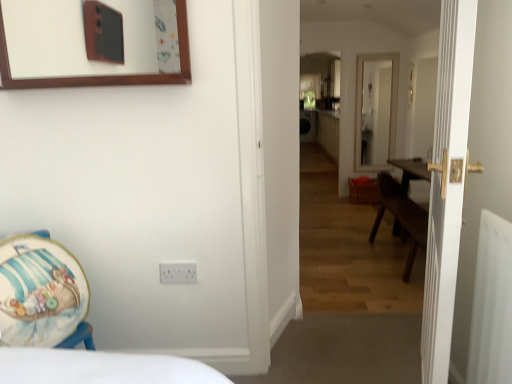
What do you see at coordinates (492, 304) in the screenshot?
I see `white plastic radiator at right` at bounding box center [492, 304].

This screenshot has width=512, height=384. In order to click on wooden floor at center in this screenshot , I will do `click(353, 163)`.

Would you consider white wooden door at right to be distant from brown wooden picture frame at upper left?

That's right, there is a large distance between white wooden door at right and brown wooden picture frame at upper left.

Which object is positioned more to the left, white wooden door at right or brown wooden picture frame at upper left?

brown wooden picture frame at upper left.

From a real-world perspective, between white wooden door at right and brown wooden picture frame at upper left, who is vertically lower?

white wooden door at right.

Locate an element on the screen. picture frame above the white wooden door at right (from the image's perspective) is located at coordinates (106, 75).

Consider the image. Considering the sizes of objects white plastic electric outlet at lower center and white wooden door at right in the image provided, who is smaller, white plastic electric outlet at lower center or white wooden door at right?

With smaller size is white plastic electric outlet at lower center.

Would you say white plastic electric outlet at lower center is outside white wooden door at right?

Indeed, white plastic electric outlet at lower center is completely outside white wooden door at right.

Does white plastic electric outlet at lower center touch white wooden door at right?

No, white plastic electric outlet at lower center is not making contact with white wooden door at right.

Does point (161, 266) appear closer or farther from the camera than point (452, 295)?

Point (161, 266).

From the image's perspective, is white plastic electric outlet at lower center above or below brown wooden picture frame at upper left?

white plastic electric outlet at lower center is below brown wooden picture frame at upper left.

Looking at their sizes, would you say white plastic electric outlet at lower center is wider or thinner than brown wooden picture frame at upper left?

Clearly, white plastic electric outlet at lower center has less width compared to brown wooden picture frame at upper left.

Is white plastic electric outlet at lower center looking in the opposite direction of brown wooden picture frame at upper left?

No, white plastic electric outlet at lower center is not facing the opposite direction of brown wooden picture frame at upper left.

What are the coordinates of `picture frame to the left of white plastic electric outlet at lower center` in the screenshot? It's located at (106, 75).

From a real-world perspective, which is physically above, wooden floor at center or white plastic radiator at right?

wooden floor at center.

Between wooden floor at center and white plastic radiator at right, which one is positioned in front?

Positioned in front is white plastic radiator at right.

Is wooden floor at center positioned with its back to white plastic radiator at right?

No, wooden floor at center is not facing away from white plastic radiator at right.

Is wooden floor at center next to white plastic radiator at right and touching it?

They are not placed beside each other.

From a real-world perspective, is wooden armchair at lower left physically above wooden floor at center?

No, from a real-world perspective, wooden armchair at lower left is not over wooden floor at center

Identify the location of corridor lying on the right of wooden armchair at lower left. The width and height of the screenshot is (512, 384). (353, 163).

Is the position of wooden armchair at lower left more distant than that of wooden floor at center?

A: No, it is not.

How different are the orientations of white wooden door at right and white plastic electric outlet at lower center in degrees?

There is a 109-degree angle between the facing directions of white wooden door at right and white plastic electric outlet at lower center.

Considering the relative sizes of white wooden door at right and white plastic electric outlet at lower center in the image provided, is white wooden door at right wider than white plastic electric outlet at lower center?

Yes.

Which is correct: white wooden door at right is inside white plastic electric outlet at lower center, or outside of it?

white wooden door at right cannot be found inside white plastic electric outlet at lower center.

The width and height of the screenshot is (512, 384). What are the coordinates of `electric outlet below the wooden floor at center (from the image's perspective)` in the screenshot? It's located at (178, 272).

In the scene shown: Is the surface of white plastic electric outlet at lower center in direct contact with wooden floor at center?

No, white plastic electric outlet at lower center is not in contact with wooden floor at center.

Considering the positions of objects white plastic electric outlet at lower center and wooden floor at center in the image provided, who is behind, white plastic electric outlet at lower center or wooden floor at center?

white plastic electric outlet at lower center is behind.

Which is less distant, (185, 276) or (342, 307)?

Point (185, 276)

Where is `picture frame above the white wooden door at right (from a real-world perspective)`? The height and width of the screenshot is (384, 512). picture frame above the white wooden door at right (from a real-world perspective) is located at coordinates (106, 75).

Identify the location of electric outlet lying behind the white wooden door at right. This screenshot has height=384, width=512. (178, 272).

From the image, which object appears to be nearer to white plastic electric outlet at lower center, wooden armchair at lower left or wooden floor at center?

Among the two, wooden armchair at lower left is located nearer to white plastic electric outlet at lower center.

Considering their positions, is wooden floor at center positioned closer to white plastic electric outlet at lower center than white plastic radiator at right?

The object closer to white plastic electric outlet at lower center is white plastic radiator at right.

Based on their spatial positions, is white wooden door at right or white plastic radiator at right closer to brown wooden picture frame at upper left?

Among the two, white wooden door at right is located nearer to brown wooden picture frame at upper left.

Looking at the image, which one is located further to white wooden door at right, brown wooden picture frame at upper left or wooden floor at center?

wooden floor at center is positioned further to the anchor white wooden door at right.

When comparing their distances from wooden armchair at lower left, does wooden floor at center or white plastic electric outlet at lower center seem further?

The object further to wooden armchair at lower left is wooden floor at center.

From the image, which object appears to be farther from wooden armchair at lower left, white wooden door at right or white plastic electric outlet at lower center?

Among the two, white wooden door at right is located further to wooden armchair at lower left.

When comparing their distances from white plastic radiator at right, does brown wooden picture frame at upper left or wooden armchair at lower left seem closer?

brown wooden picture frame at upper left.

Estimate the real-world distances between objects in this image. Which object is further from white plastic electric outlet at lower center, wooden floor at center or wooden armchair at lower left?

wooden floor at center is further to white plastic electric outlet at lower center.

This screenshot has width=512, height=384. I want to click on picture frame situated between wooden armchair at lower left and white plastic radiator at right from left to right, so click(x=106, y=75).

Find the location of a particular element. radiator positioned between white wooden door at right and wooden floor at center from near to far is located at coordinates (492, 304).

Where is `corridor situated between white plastic electric outlet at lower center and white wooden door at right from left to right`? corridor situated between white plastic electric outlet at lower center and white wooden door at right from left to right is located at coordinates (353, 163).

The width and height of the screenshot is (512, 384). I want to click on corridor situated between white plastic electric outlet at lower center and white plastic radiator at right from left to right, so click(x=353, y=163).